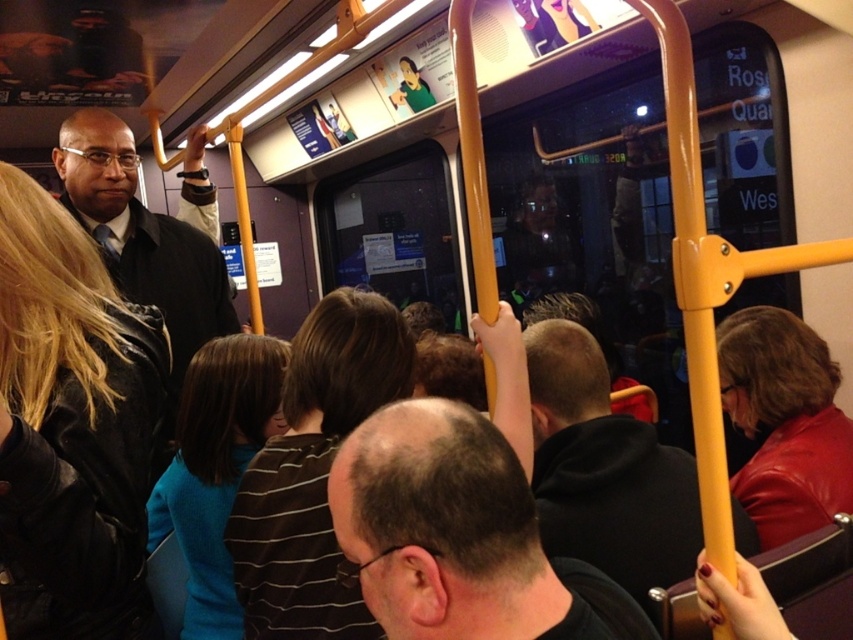
You are a passenger on a crowded bus and need to decide whether to sit or stand. You notice a striped shirt at center and a shiny red leather jacket at right. Which clothing item is bigger in size?

The striped shirt at center is larger in size compared to the shiny red leather jacket at right.

You are a passenger on a crowded bus or train and want to know which of the two points, point (753, 524) or point (840, 490), is closer to you. Can you determine this based on your current position?

Point (753, 524) is closer to the viewer than point (840, 490), so the answer is point (753, 524).

From the picture: You are a passenger on a crowded bus and want to move from your seat to the exit door, which is behind you. You need to pass between the black hoodie at center and the shiny red leather jacket at right. Can you safely walk through this space without touching either?

The distance between the black hoodie at center and the shiny red leather jacket at right is 17.21 inches. Since this space is narrow, it might be challenging to pass through without touching either, especially in a crowded environment. Consider waiting for a less crowded moment or finding an alternative path.